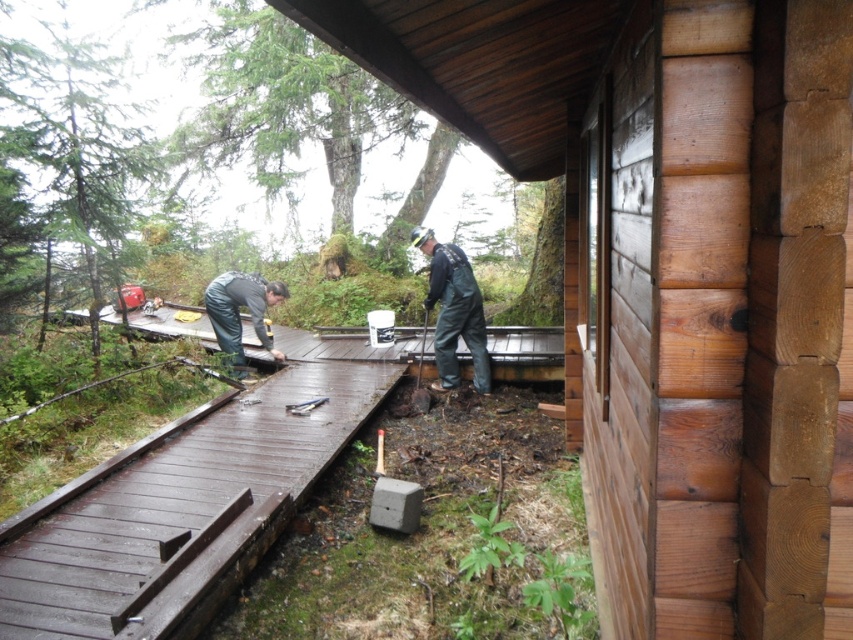
Is dark brown wooden porch at center taller than dark gray rubber boots at center?

No, dark brown wooden porch at center is not taller than dark gray rubber boots at center.

Can you confirm if dark brown wooden porch at center is shorter than dark gray rubber boots at center?

Correct, dark brown wooden porch at center is not as tall as dark gray rubber boots at center.

Which is in front, point (518, 378) or point (474, 285)?

Point (474, 285)

You are a GUI agent. You are given a task and a screenshot of the screen. Output one action in this format:
    pyautogui.click(x=<x>, y=<y>)
    Task: Click on the dark brown wooden porch at center
    The height and width of the screenshot is (640, 853).
    Given the screenshot: What is the action you would take?
    pyautogui.click(x=346, y=342)

Can you confirm if smooth wooden log cabin at center is shorter than metallic silver hammer at lower center?

In fact, smooth wooden log cabin at center may be taller than metallic silver hammer at lower center.

Does smooth wooden log cabin at center come in front of metallic silver hammer at lower center?

Yes, it is.

Which is in front, point (566, 305) or point (321, 397)?

Point (566, 305) is more forward.

Find the location of a particular element. The height and width of the screenshot is (640, 853). smooth wooden log cabin at center is located at coordinates (675, 276).

Is smooth wooden log cabin at center bigger than dark gray rubber boots at center?

Indeed, smooth wooden log cabin at center has a larger size compared to dark gray rubber boots at center.

Is smooth wooden log cabin at center wider than dark gray rubber boots at center?

Indeed, smooth wooden log cabin at center has a greater width compared to dark gray rubber boots at center.

In order to click on smooth wooden log cabin at center in this screenshot , I will do `click(675, 276)`.

The image size is (853, 640). In order to click on smooth wooden log cabin at center in this screenshot , I will do `click(675, 276)`.